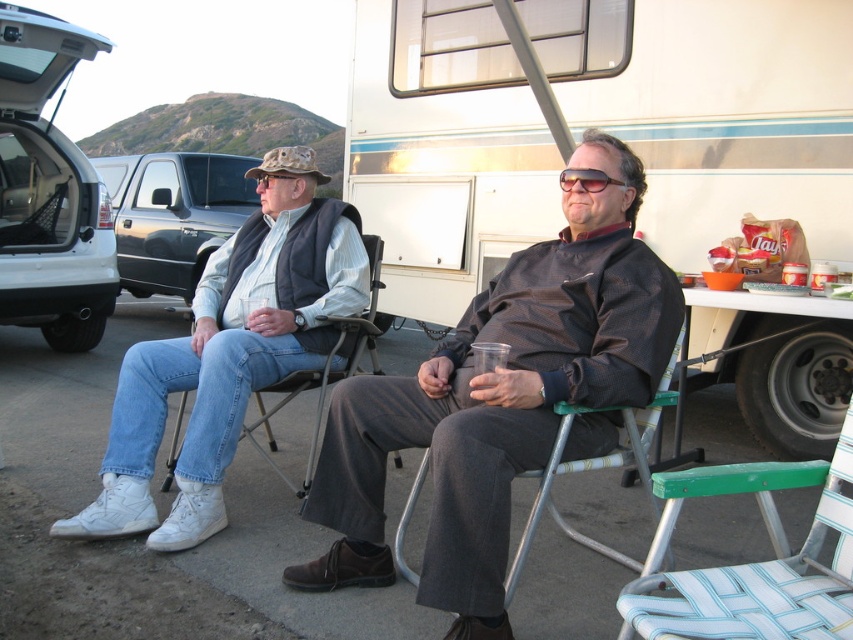
Find the location of a particular element. This screenshot has width=853, height=640. white matte van at left is located at coordinates (49, 189).

How far apart are white matte van at left and green plastic chair at center?

They are 4.25 meters apart.

This screenshot has height=640, width=853. In order to click on white matte van at left in this screenshot , I will do `click(49, 189)`.

Between white matte van at left and brushed metal truck at upper left, which one is positioned lower?

white matte van at left is lower down.

Is point (32, 72) behind point (238, 218)?

No, it is in front of (238, 218).

Between point (57, 256) and point (143, 284), which one is positioned behind?

Positioned behind is point (143, 284).

Where is `white matte van at left`? The image size is (853, 640). white matte van at left is located at coordinates (49, 189).

Is brushed metal truck at upper left bigger than denim fabric chair at left?

Yes.

Is point (122, 220) positioned behind point (343, 346)?

Yes.

At what (x,y) coordinates should I click in order to perform the action: click on brushed metal truck at upper left. Please return your answer as a coordinate pair (x, y). The width and height of the screenshot is (853, 640). Looking at the image, I should click on (173, 214).